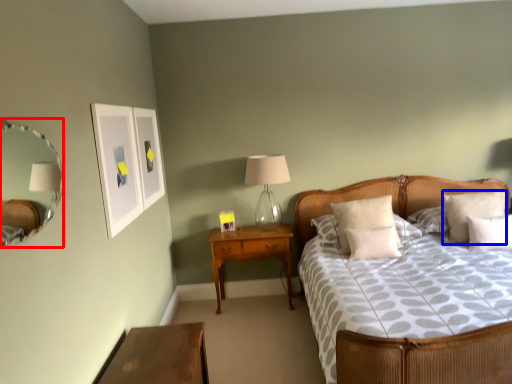
Question: Among these objects, which one is farthest to the camera, mirror (highlighted by a red box) or pillow (highlighted by a blue box)?

Choices:
 (A) mirror
 (B) pillow

Answer: (B)